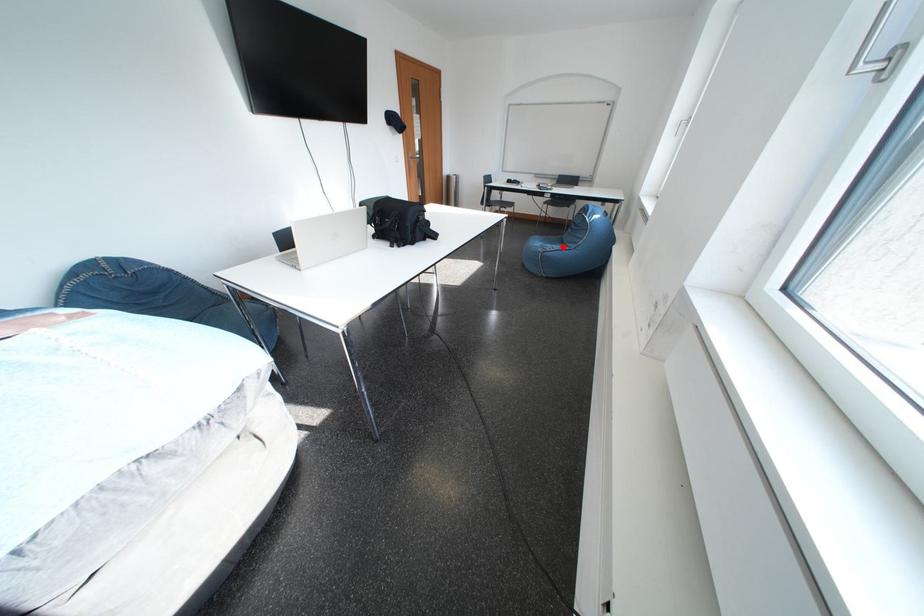
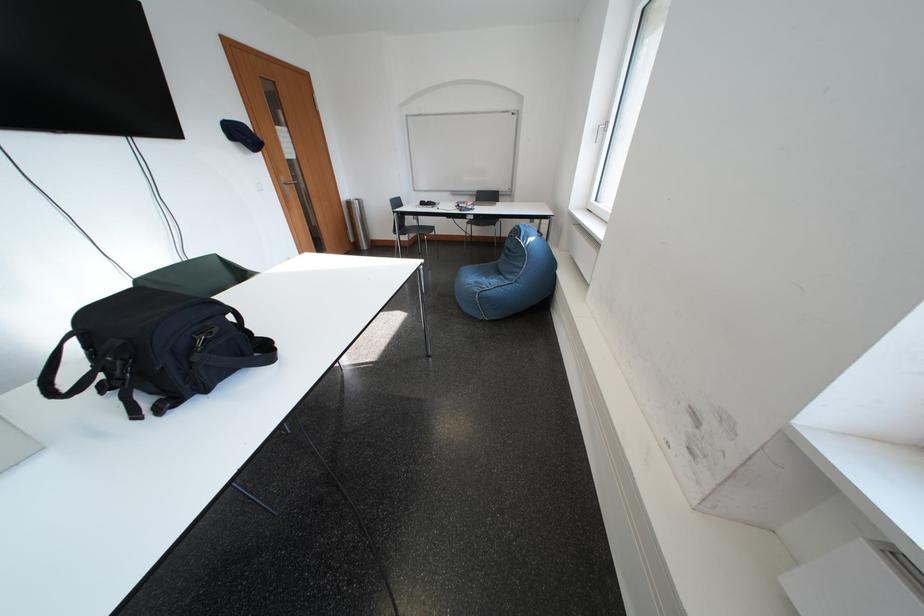
The point at the highlighted location is marked in the first image. Where is the corresponding point in the second image?

(497, 278)